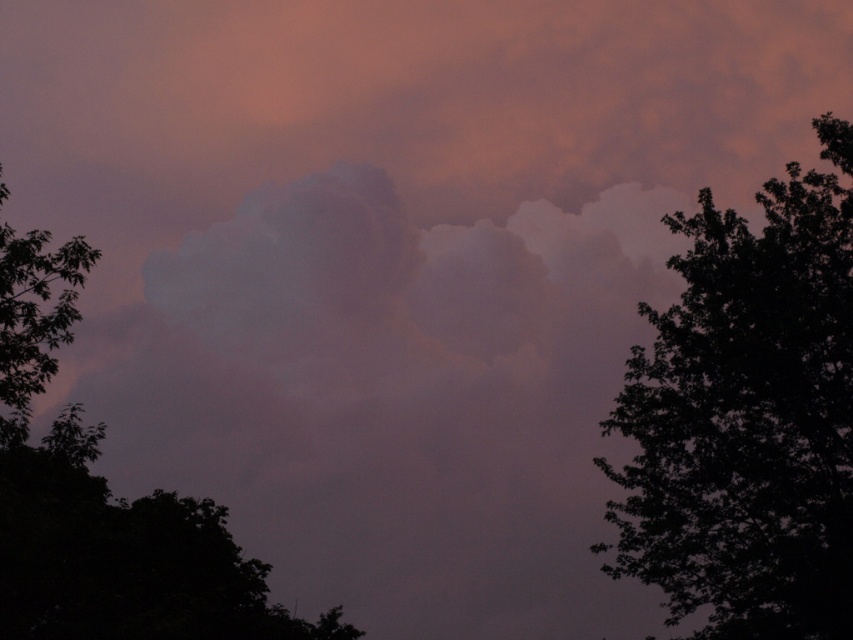
Question: Which point appears closest to the camera in this image?

Choices:
 (A) (282, 637)
 (B) (723, 312)
 (C) (76, 296)

Answer: (C)

Question: Which point is closer to the camera?

Choices:
 (A) green leafy tree at left
 (B) dark green leafy tree at left
 (C) silhouette leafy tree at right

Answer: (B)

Question: Is silhouette leafy tree at right bigger than dark green leafy tree at left?

Choices:
 (A) yes
 (B) no

Answer: (B)

Question: Does silhouette leafy tree at right have a larger size compared to dark green leafy tree at left?

Choices:
 (A) yes
 (B) no

Answer: (B)

Question: Estimate the real-world distances between objects in this image. Which object is closer to the silhouette leafy tree at right?

Choices:
 (A) dark green leafy tree at left
 (B) green leafy tree at left

Answer: (A)

Question: Observing the image, what is the correct spatial positioning of silhouette leafy tree at right in reference to dark green leafy tree at left?

Choices:
 (A) above
 (B) below

Answer: (B)